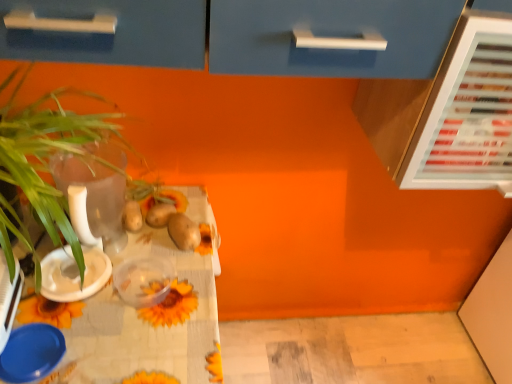
Question: Which is correct: yellow matte flower at center is inside white plastic bowl at left, which is counted as the 3th tableware, starting from the bottom, or outside of it?

Choices:
 (A) outside
 (B) inside

Answer: (A)

Question: Considering the relative positions of yellow matte flower at center and white plastic bowl at left, which is counted as the 3th tableware, starting from the bottom, in the image provided, is yellow matte flower at center to the left or to the right of white plastic bowl at left, which is counted as the 3th tableware, starting from the bottom,?

Choices:
 (A) right
 (B) left

Answer: (A)

Question: Which object is the closest to the transparent glass vase at left?

Choices:
 (A) blue plastic bowl at lower left
 (B) yellow matte flower at center
 (C) translucent plastic container at center, arranged as the 2th tableware when ordered from the bottom
 (D) blue plastic lid at lower left, positioned as the 3th tableware in top-to-bottom order
 (E) white plastic bowl at left, which is counted as the 3th tableware, starting from the bottom

Answer: (B)

Question: Which is nearer to the sunflower-patterned tablecloth at lower left?

Choices:
 (A) yellow matte flower at center
 (B) translucent plastic container at center, arranged as the 2th tableware when ordered from the bottom
 (C) blue plastic bowl at lower left
 (D) green leafy plant at left
 (E) white plastic bowl at left, the first tableware from the top

Answer: (B)